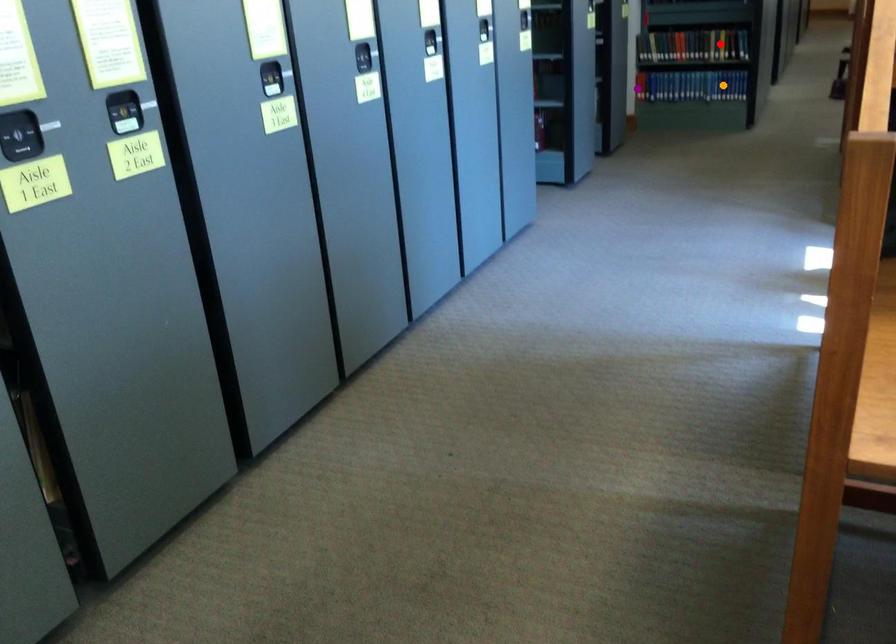
Order these from nearest to farthest:
red point, purple point, orange point

red point < orange point < purple point